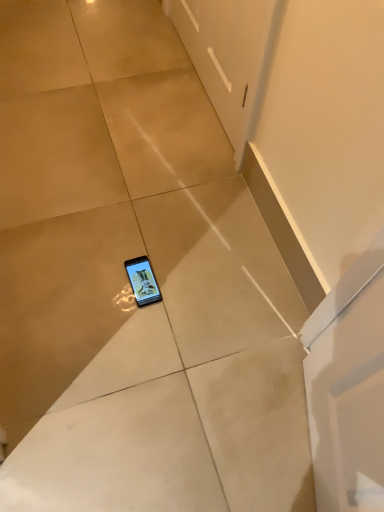
Identify the location of matte black phone at center. The image size is (384, 512). (142, 281).

What is the approximate width of matte black phone at center?

matte black phone at center is 6.66 inches wide.

What do you see at coordinates (142, 281) in the screenshot? I see `matte black phone at center` at bounding box center [142, 281].

Locate an element on the screen. Image resolution: width=384 pixels, height=512 pixels. matte black phone at center is located at coordinates (142, 281).